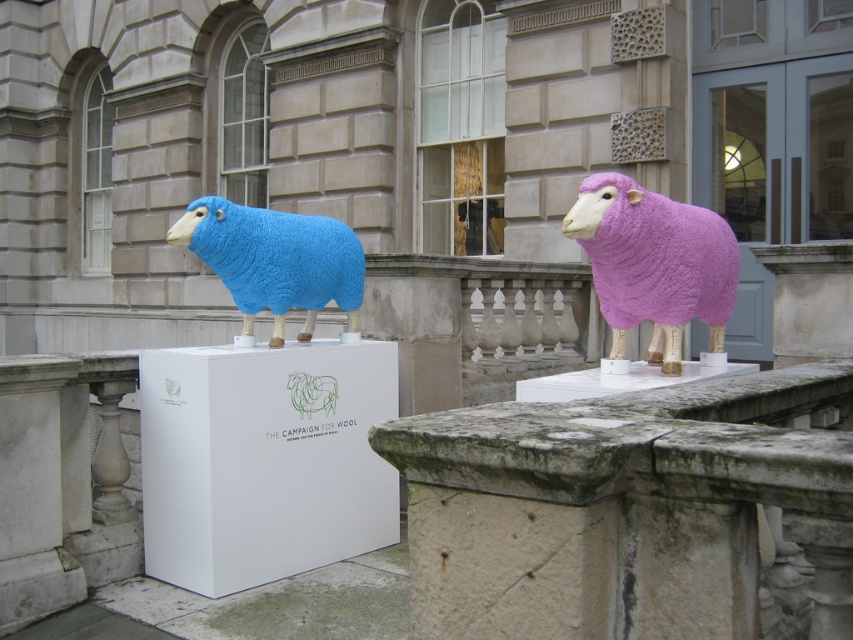
Is pink woolen sheep at center to the right of matte blue woolen sheep at left from the viewer's perspective?

Yes, pink woolen sheep at center is to the right of matte blue woolen sheep at left.

Which is more to the right, pink woolen sheep at center or matte blue woolen sheep at left?

pink woolen sheep at center

Does point (595, 173) come in front of point (320, 262)?

Yes, it is in front of point (320, 262).

Locate an element on the screen. The width and height of the screenshot is (853, 640). pink woolen sheep at center is located at coordinates (654, 262).